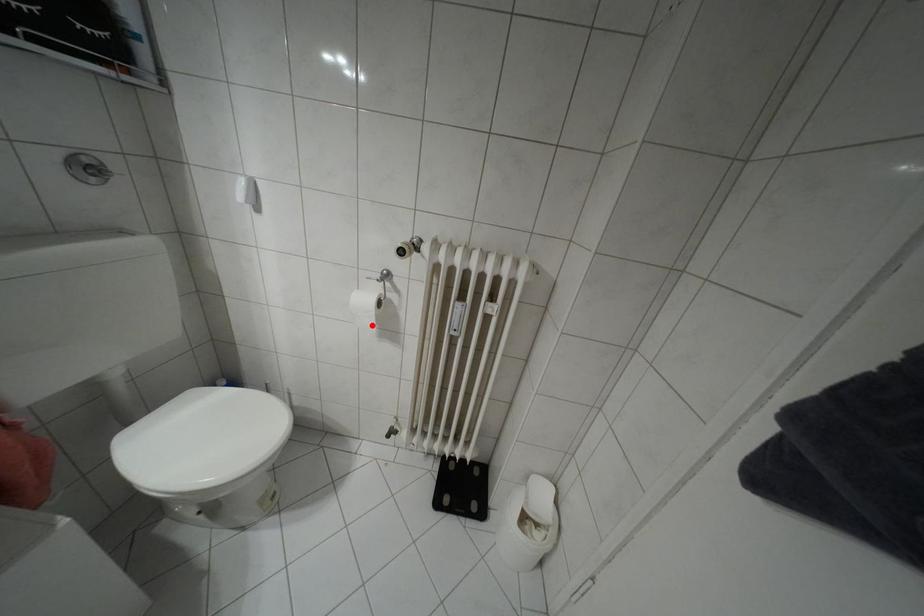
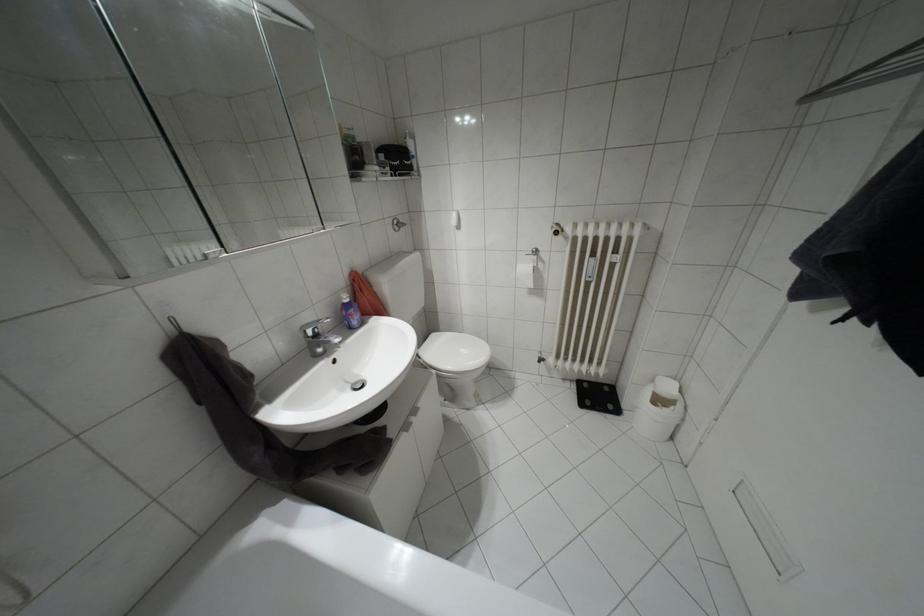
Locate, in the second image, the point that corresponds to the highlighted location in the first image.

(530, 284)